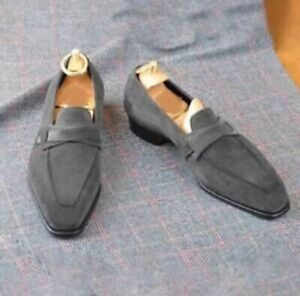
What are the coordinates of `plaid cloth` in the screenshot? It's located at tap(160, 213).